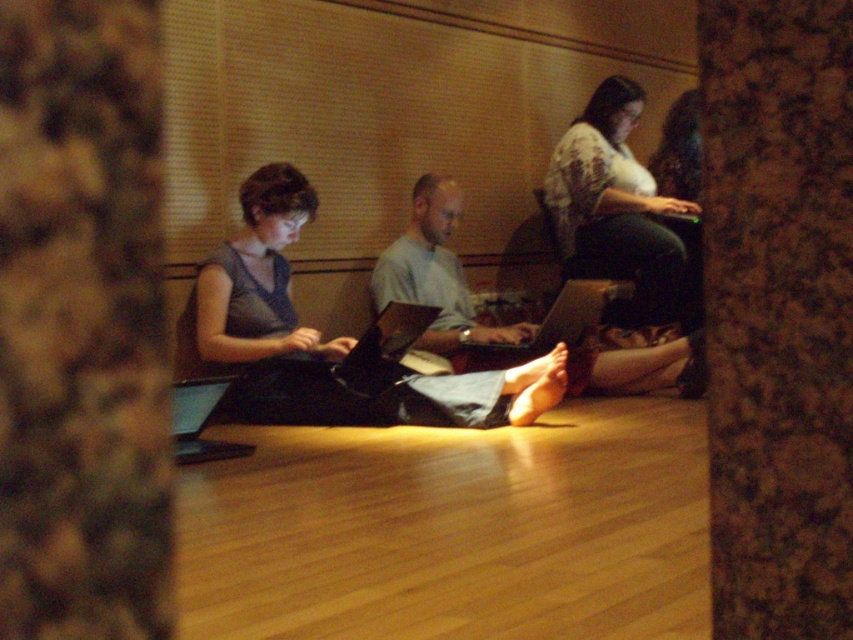
Question: Can you confirm if matte black laptop at center is wider than patterned fabric shirt at upper right?

Choices:
 (A) yes
 (B) no

Answer: (A)

Question: Can you confirm if brown textured pillar at center is wider than light blue fabric pants at center?

Choices:
 (A) yes
 (B) no

Answer: (B)

Question: Which object is the farthest from the shiny black laptop at center?

Choices:
 (A) matte black laptop at center
 (B) black glossy laptop at lower left
 (C) patterned fabric shirt at upper right
 (D) light blue fabric pants at center

Answer: (B)

Question: Which is farther from the patterned fabric shirt at upper right?

Choices:
 (A) matte black laptop at center
 (B) light blue fabric pants at center
 (C) black glossy laptop at lower left

Answer: (C)

Question: Can you confirm if matte black laptop at center is positioned above patterned fabric shirt at upper right?

Choices:
 (A) yes
 (B) no

Answer: (B)

Question: Estimate the real-world distances between objects in this image. Which object is closer to the black glossy laptop at lower left?

Choices:
 (A) shiny black laptop at center
 (B) patterned fabric shirt at upper right

Answer: (A)